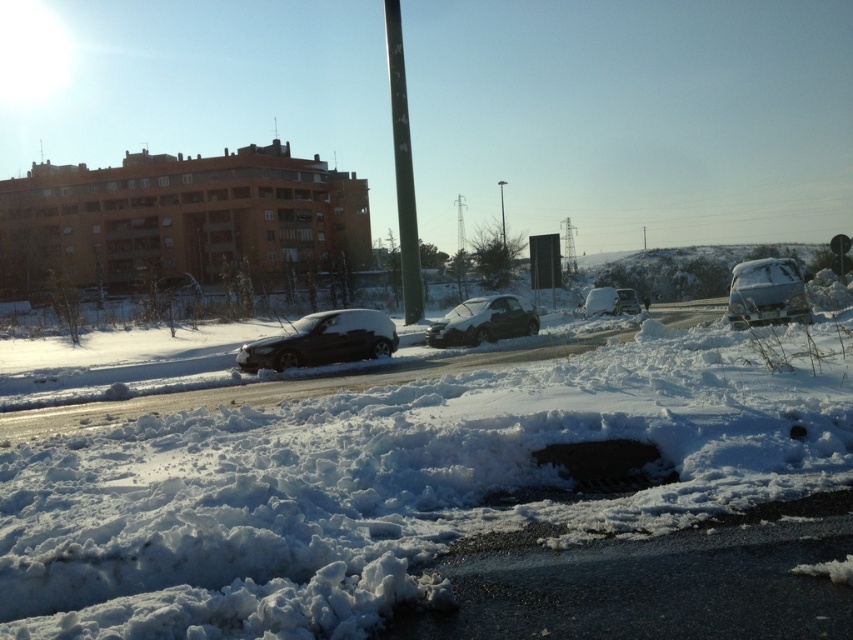
Can you confirm if glossy black car at center-left is bigger than white matte van at center-right?

Yes, glossy black car at center-left is bigger than white matte van at center-right.

Between glossy black car at center-left and white matte van at center-right, which one appears on the right side from the viewer's perspective?

Positioned to the right is white matte van at center-right.

This screenshot has width=853, height=640. I want to click on glossy black car at center-left, so click(x=322, y=340).

Between sleek silver sedan at center and white matte van at center-right, which one appears on the right side from the viewer's perspective?

From the viewer's perspective, white matte van at center-right appears more on the right side.

Where is `sleek silver sedan at center`? sleek silver sedan at center is located at coordinates (485, 321).

Locate an element on the screen. Image resolution: width=853 pixels, height=640 pixels. sleek silver sedan at center is located at coordinates (485, 321).

Does glossy black car at center-left have a greater height compared to green matte pole at center?

No.

Which is behind, point (264, 356) or point (397, 32)?

The point (397, 32) is more distant.

Who is more forward, (376, 348) or (405, 284)?

Positioned in front is point (376, 348).

Locate an element on the screen. The width and height of the screenshot is (853, 640). glossy black car at center-left is located at coordinates click(x=322, y=340).